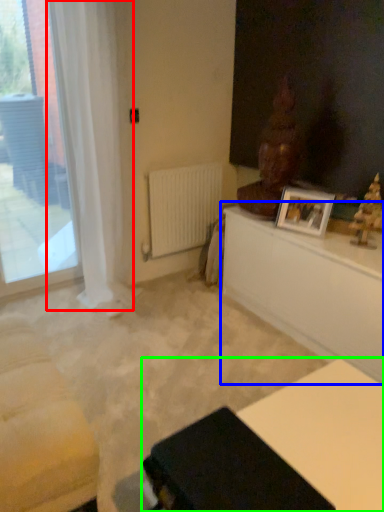
Question: Considering the real-world distances, which object is farthest from curtain (highlighted by a red box)? table (highlighted by a blue box) or table (highlighted by a green box)?

Choices:
 (A) table
 (B) table

Answer: (B)